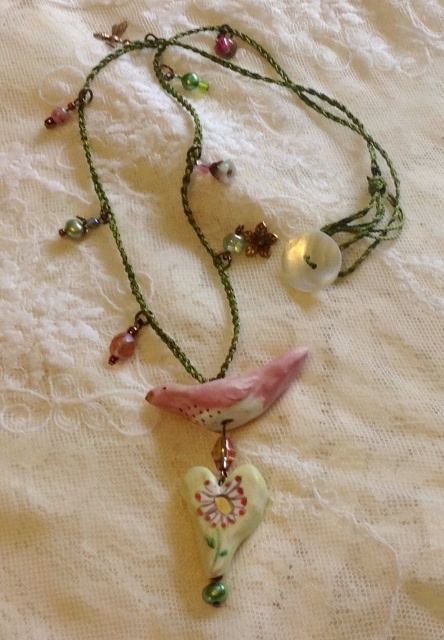
You are an appraiser examining a necklace with two pendants. You see the porcelain heart at center and the matte pink clay bird at center. Which pendant is placed higher on the necklace?

The porcelain heart at center is positioned over the matte pink clay bird at center, so it is placed higher on the necklace.

You are an appraiser examining the necklace. The porcelain heart at center is crucial for valuation. Can you determine its exact coordinates on the necklace?

The porcelain heart at center is located at coordinates point (199, 157).